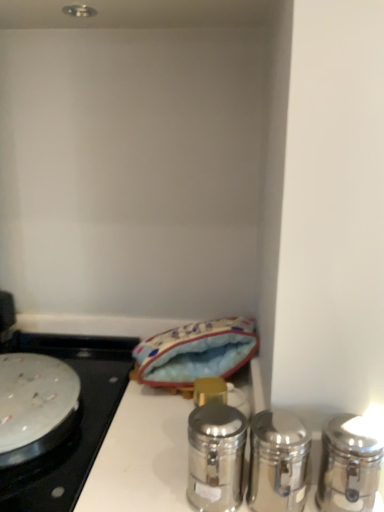
Question: Does polished silver shaker at center, which is the 1th salt and pepper shakers from left to right, have a greater width compared to polished silver shaker at right, the 2th salt and pepper shakers when ordered from left to right?

Choices:
 (A) no
 (B) yes

Answer: (B)

Question: Can you confirm if polished silver shaker at center, the 3th salt and pepper shakers viewed from the right, is thinner than polished silver shaker at right, positioned as the 2th salt and pepper shakers in right-to-left order?

Choices:
 (A) yes
 (B) no

Answer: (B)

Question: Is the depth of polished silver shaker at center, the 3th salt and pepper shakers viewed from the right, greater than that of polished silver shaker at right, the 2th salt and pepper shakers when ordered from left to right?

Choices:
 (A) no
 (B) yes

Answer: (B)

Question: From the image's perspective, is polished silver shaker at center, the 3th salt and pepper shakers viewed from the right, beneath polished silver shaker at right, the 2th salt and pepper shakers when ordered from left to right?

Choices:
 (A) yes
 (B) no

Answer: (B)

Question: Is polished silver shaker at center, the 3th salt and pepper shakers viewed from the right, oriented away from polished silver shaker at right, positioned as the 2th salt and pepper shakers in right-to-left order?

Choices:
 (A) no
 (B) yes

Answer: (A)

Question: Does polished silver shaker at center, which is the 1th salt and pepper shakers from left to right, have a larger size compared to polished silver shaker at right, the 2th salt and pepper shakers when ordered from left to right?

Choices:
 (A) no
 (B) yes

Answer: (B)

Question: From the image's perspective, is silver metallic pan at left beneath blue fabric pouch at center?

Choices:
 (A) yes
 (B) no

Answer: (A)

Question: Considering the relative positions of silver metallic pan at left and blue fabric pouch at center in the image provided, is silver metallic pan at left to the right of blue fabric pouch at center from the viewer's perspective?

Choices:
 (A) yes
 (B) no

Answer: (B)

Question: From the image's perspective, is silver metallic pan at left located above blue fabric pouch at center?

Choices:
 (A) no
 (B) yes

Answer: (A)

Question: Is the depth of silver metallic pan at left greater than that of blue fabric pouch at center?

Choices:
 (A) no
 (B) yes

Answer: (A)

Question: Can you confirm if silver metallic pan at left is smaller than blue fabric pouch at center?

Choices:
 (A) yes
 (B) no

Answer: (A)

Question: Considering the relative sizes of silver metallic pan at left and blue fabric pouch at center in the image provided, is silver metallic pan at left wider than blue fabric pouch at center?

Choices:
 (A) no
 (B) yes

Answer: (B)

Question: Is polished silver shaker at right, which ranks as the 1th salt and pepper shakers in right-to-left order, positioned in front of silver metallic pan at left?

Choices:
 (A) yes
 (B) no

Answer: (A)